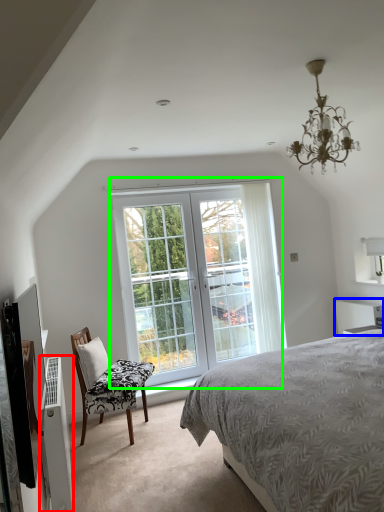
Question: Which is farther away from air conditioner (highlighted by a red box)? vanity (highlighted by a blue box) or window (highlighted by a green box)?

Choices:
 (A) vanity
 (B) window

Answer: (A)